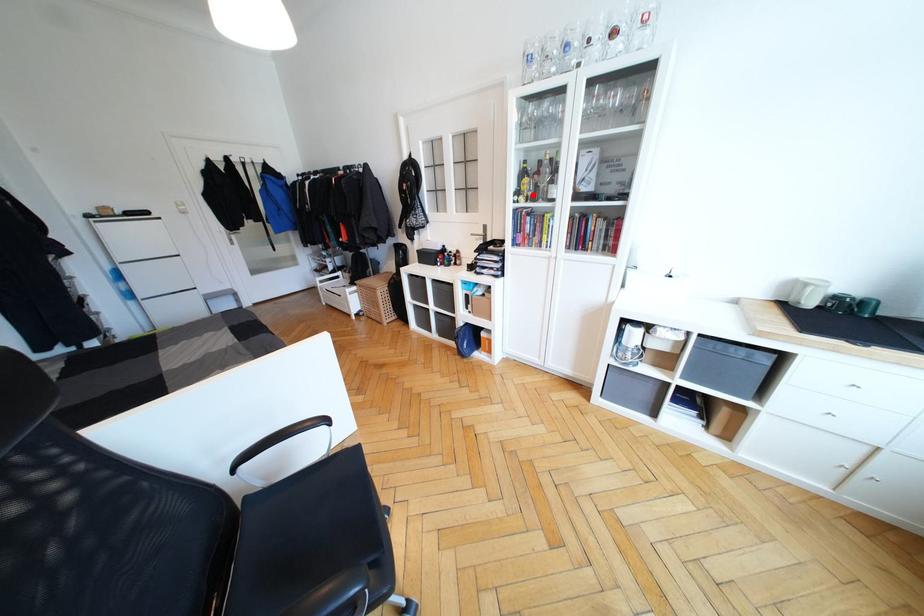
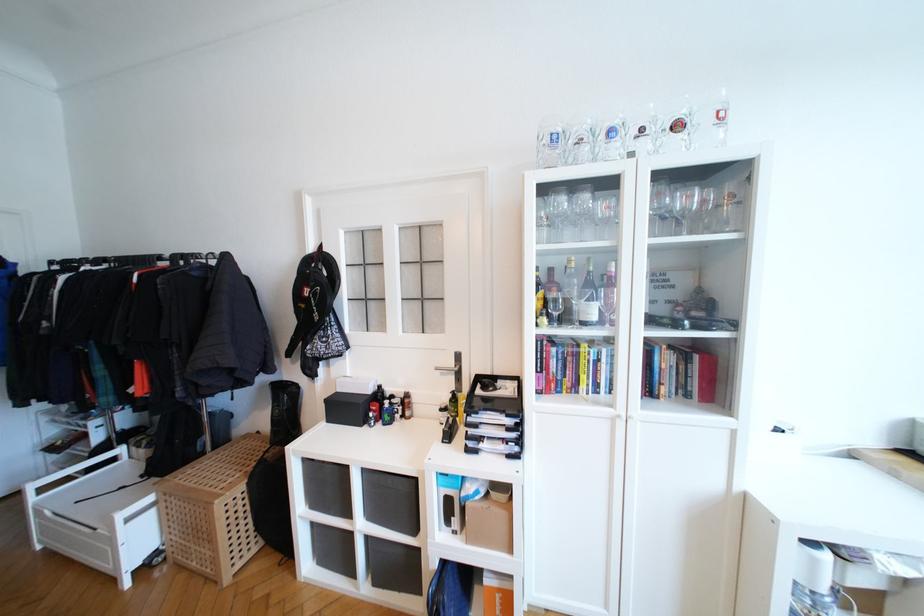
Find the pixel in the second image that matches the highlighted location in the first image.

(558, 315)